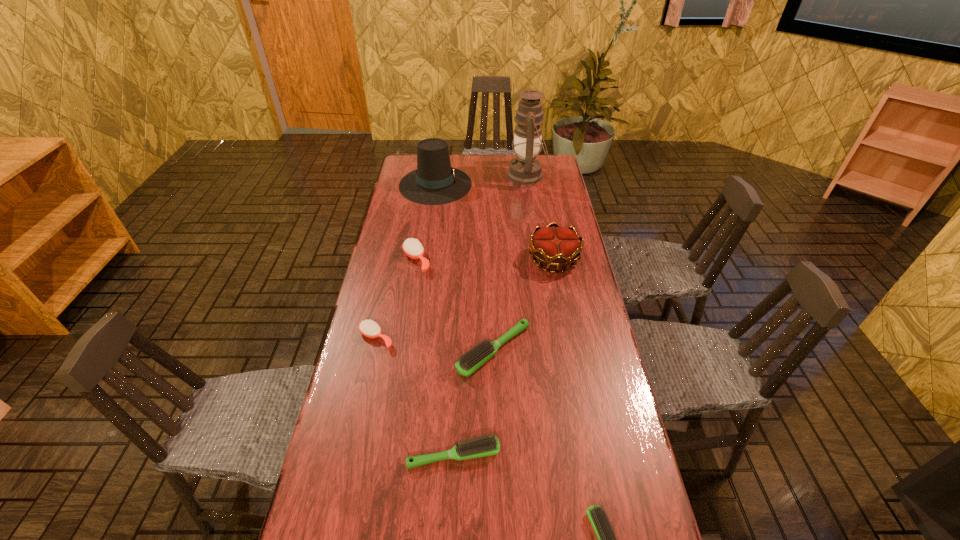
Find the location of a particular element. The height and width of the screenshot is (540, 960). free space that satisfies the following two spatial constraints: 1. on the front-facing side of the sixth shortest object; 2. on the left side of the gray hat is located at coordinates (425, 259).